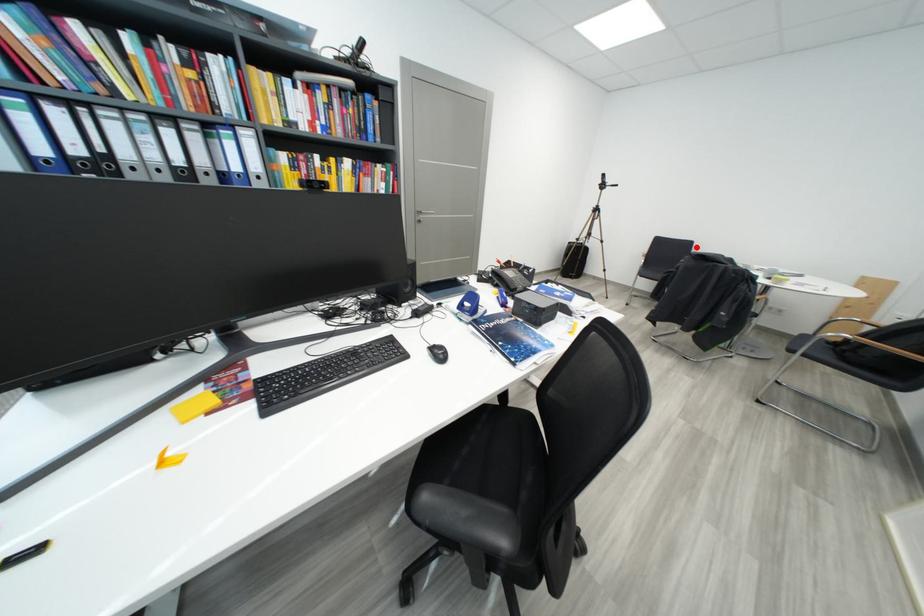
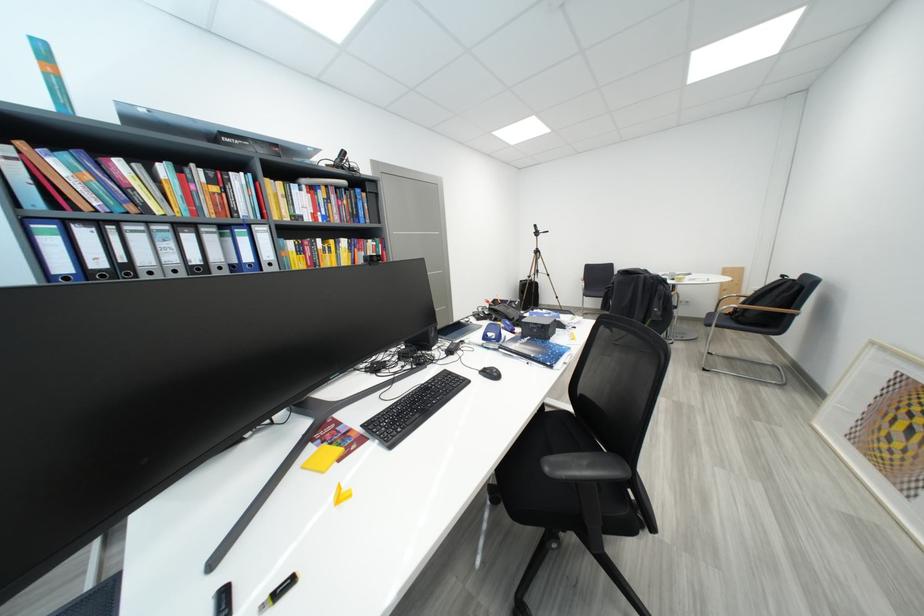
In the second image, find the point that corresponds to the highlighted location in the first image.

(618, 269)